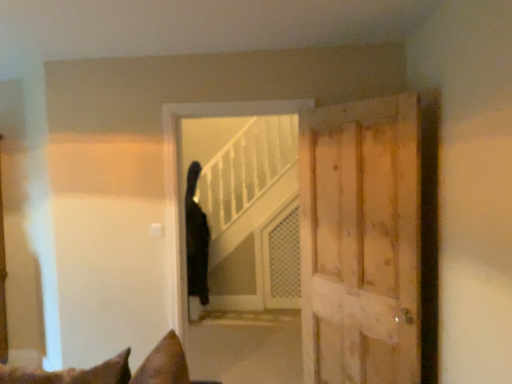
Image resolution: width=512 pixels, height=384 pixels. Describe the element at coordinates (360, 242) in the screenshot. I see `light brown wooden door at right` at that location.

Locate an element on the screen. black fur cat at center is located at coordinates (196, 239).

Where is `light brown wooden door at right`? light brown wooden door at right is located at coordinates (360, 242).

Is white mesh screen door at center to the left of light brown wooden door at right from the viewer's perspective?

Yes, white mesh screen door at center is to the left of light brown wooden door at right.

Locate an element on the screen. Image resolution: width=512 pixels, height=384 pixels. screen door located behind the light brown wooden door at right is located at coordinates (282, 259).

From the image's perspective, which is above, white mesh screen door at center or light brown wooden door at right?

From the image's view, light brown wooden door at right is above.

Between white mesh screen door at center and black fur cat at center, which one has larger size?

Bigger between the two is white mesh screen door at center.

Which object is further away from the camera, white mesh screen door at center or black fur cat at center?

white mesh screen door at center is further away from the camera.

Would you say white mesh screen door at center is to the left or to the right of black fur cat at center in the picture?

Clearly, white mesh screen door at center is on the right of black fur cat at center in the image.

Does point (266, 291) lie behind point (188, 263)?

That is True.

From their relative heights in the image, would you say light brown wooden door at right is taller or shorter than white mesh screen door at center?

light brown wooden door at right is taller than white mesh screen door at center.

Considering the positions of point (402, 143) and point (278, 269), is point (402, 143) closer or farther from the camera than point (278, 269)?

Clearly, point (402, 143) is closer to the camera than point (278, 269).

From the image's perspective, does light brown wooden door at right appear higher than white mesh screen door at center?

Yes, from the image's perspective, light brown wooden door at right is above white mesh screen door at center.

Consider the image. Would you say light brown wooden door at right is outside white mesh screen door at center?

light brown wooden door at right lies outside white mesh screen door at center's area.

Based on the photo, from the image's perspective, is black fur cat at center below white mesh screen door at center?

No, from the image's perspective, black fur cat at center is not below white mesh screen door at center.

In terms of width, does black fur cat at center look wider or thinner when compared to white mesh screen door at center?

In the image, black fur cat at center appears to be wider than white mesh screen door at center.

Is black fur cat at center not within white mesh screen door at center?

Yes, black fur cat at center is located beyond the bounds of white mesh screen door at center.

Which object is further away from the camera, black fur cat at center or white mesh screen door at center?

white mesh screen door at center is behind.

In the scene shown: From their relative heights in the image, would you say black fur cat at center is taller or shorter than light brown wooden door at right?

Considering their sizes, black fur cat at center has less height than light brown wooden door at right.

From the image's perspective, is black fur cat at center over light brown wooden door at right?

No, from the image's perspective, black fur cat at center is not on top of light brown wooden door at right.

Considering the relative sizes of white mesh screen door at center and black matte elevator at center in the image provided, is white mesh screen door at center bigger than black matte elevator at center?

Actually, white mesh screen door at center might be smaller than black matte elevator at center.

How much distance is there between white mesh screen door at center and black matte elevator at center?

A distance of 11.03 inches exists between white mesh screen door at center and black matte elevator at center.

Does white mesh screen door at center have a lesser height compared to black matte elevator at center?

Yes, white mesh screen door at center is shorter than black matte elevator at center.

Identify the location of screen door that appears below the black matte elevator at center (from a real-world perspective). click(x=282, y=259).

From a real-world perspective, is black matte elevator at center physically located above or below light brown wooden door at right?

black matte elevator at center is below light brown wooden door at right.

Does black matte elevator at center have a lesser width compared to light brown wooden door at right?

In fact, black matte elevator at center might be wider than light brown wooden door at right.

Can you tell me how much black matte elevator at center and light brown wooden door at right differ in facing direction?

46.2 degrees.

From the picture: Is black matte elevator at center beside light brown wooden door at right?

black matte elevator at center is not next to light brown wooden door at right, and they're not touching.

This screenshot has width=512, height=384. Find the location of `door that appears above the white mesh screen door at center (from the image's perspective)`. door that appears above the white mesh screen door at center (from the image's perspective) is located at coordinates (360, 242).

At what (x,y) coordinates should I click in order to perform the action: click on screen door behind the black fur cat at center. Please return your answer as a coordinate pair (x, y). This screenshot has height=384, width=512. Looking at the image, I should click on (282, 259).

Considering their positions, is light brown wooden door at right positioned closer to black matte elevator at center than white mesh screen door at center?

Based on the image, white mesh screen door at center appears to be nearer to black matte elevator at center.

From the image, which object appears to be nearer to white mesh screen door at center, light brown wooden door at right or black matte elevator at center?

Based on the image, black matte elevator at center appears to be nearer to white mesh screen door at center.

Estimate the real-world distances between objects in this image. Which object is closer to black fur cat at center, black matte elevator at center or white mesh screen door at center?

Based on the image, black matte elevator at center appears to be nearer to black fur cat at center.

Based on their spatial positions, is white mesh screen door at center or black matte elevator at center further from black fur cat at center?

white mesh screen door at center lies further to black fur cat at center than the other object.

Which object lies nearer to the anchor point light brown wooden door at right, white mesh screen door at center or black matte elevator at center?

Based on the image, black matte elevator at center appears to be nearer to light brown wooden door at right.

When comparing their distances from white mesh screen door at center, does black matte elevator at center or light brown wooden door at right seem further?

The object further to white mesh screen door at center is light brown wooden door at right.

Considering their positions, is black fur cat at center positioned further to light brown wooden door at right than white mesh screen door at center?

white mesh screen door at center lies further to light brown wooden door at right than the other object.

From the image, which object appears to be farther from light brown wooden door at right, white mesh screen door at center or black fur cat at center?

white mesh screen door at center lies further to light brown wooden door at right than the other object.

Find the location of a particular element. This screenshot has width=512, height=384. elevator between light brown wooden door at right and black fur cat at center in the front-back direction is located at coordinates (249, 209).

Locate an element on the screen. This screenshot has height=384, width=512. cat between light brown wooden door at right and white mesh screen door at center along the z-axis is located at coordinates (196, 239).

Find the location of a particular element. Image resolution: width=512 pixels, height=384 pixels. cat located between black matte elevator at center and white mesh screen door at center in the depth direction is located at coordinates (196, 239).

Identify the location of elevator between light brown wooden door at right and white mesh screen door at center in the front-back direction. This screenshot has width=512, height=384. (249, 209).